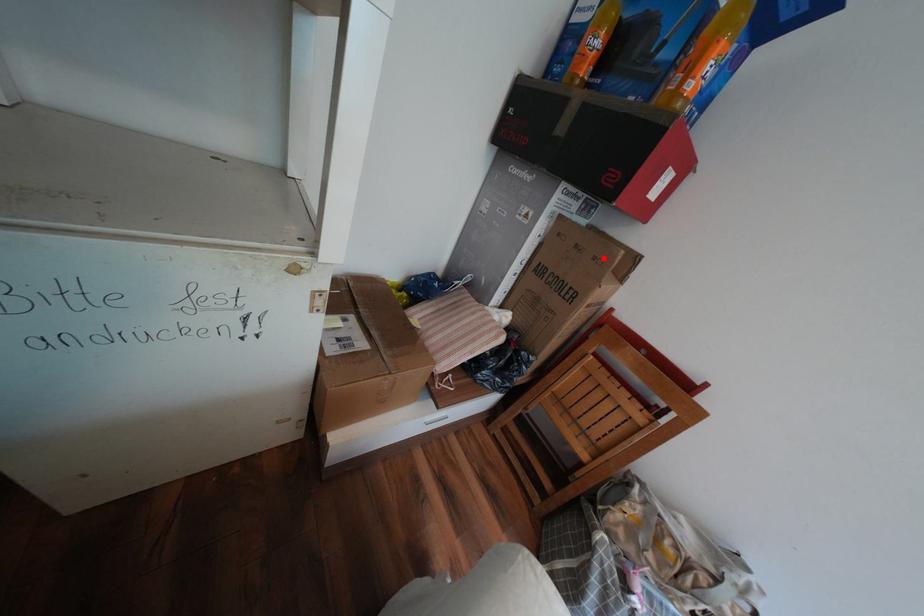
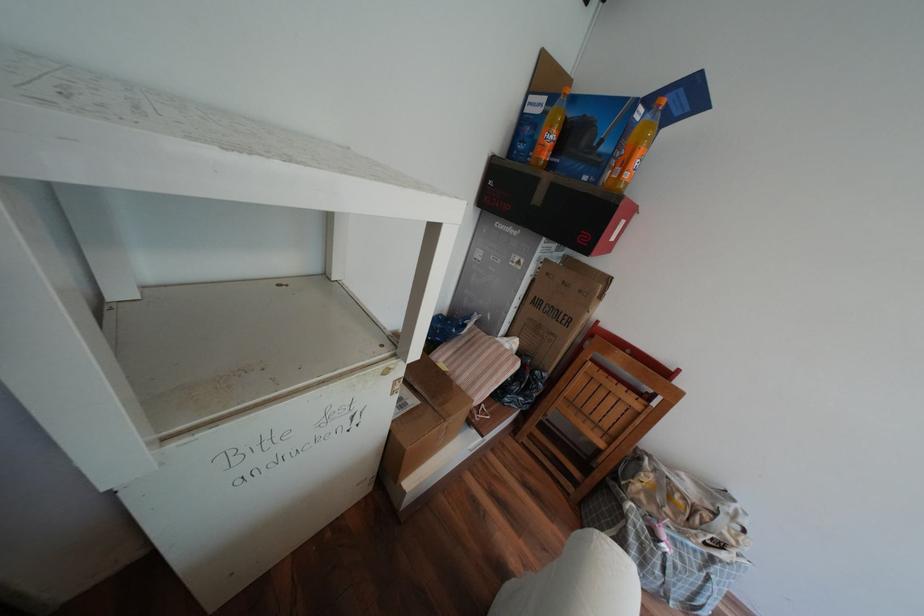
The point at the highlighted location is marked in the first image. Where is the corresponding point in the second image?

(590, 291)